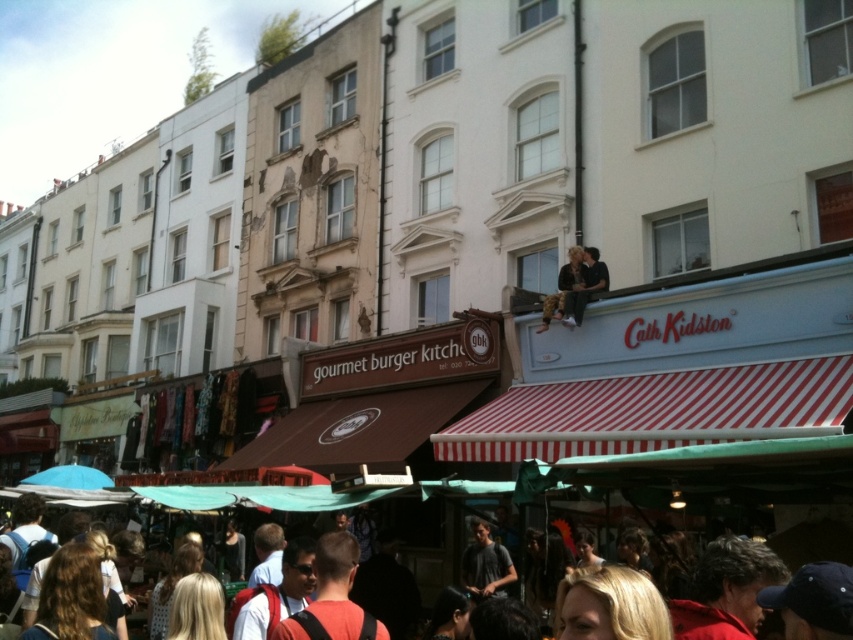
What is the position of the orange fabric backpack at lower center relative to the brown leather jacket at upper center?

The orange fabric backpack at lower center is positioned to the left of the brown leather jacket at upper center.

You are a photographer standing in the middle of the market street. You notice an orange fabric backpack at lower center and a person with blonde hair at lower center. Which object is located more to the left side of the scene?

The orange fabric backpack at lower center is positioned on the left side of blonde hair at lower center, so it is more to the left in the scene.